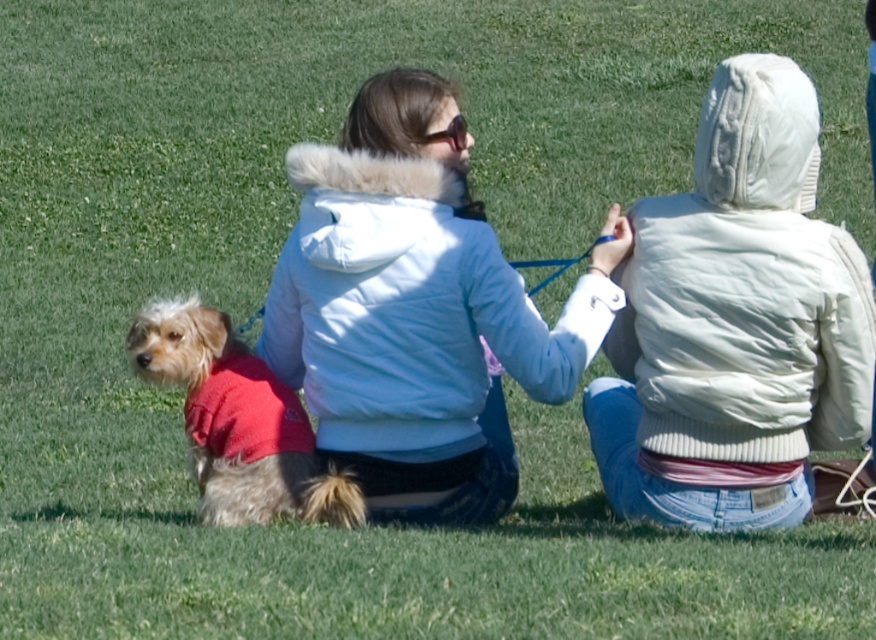
Is light blue puffy jacket at center to the left of fuzzy red sweater at lower left from the viewer's perspective?

Incorrect, light blue puffy jacket at center is not on the left side of fuzzy red sweater at lower left.

Which is behind, point (398, 518) or point (298, 404)?

Point (298, 404)

Does point (421, 420) lie in front of point (246, 358)?

Yes.

Locate an element on the screen. The width and height of the screenshot is (876, 640). light blue puffy jacket at center is located at coordinates (415, 310).

Measure the distance from white fuzzy jacket at upper right to light blue puffy jacket at center.

white fuzzy jacket at upper right and light blue puffy jacket at center are 24.01 inches apart from each other.

Is white fuzzy jacket at upper right to the left of light blue puffy jacket at center from the viewer's perspective?

No, white fuzzy jacket at upper right is not to the left of light blue puffy jacket at center.

Find the location of a particular element. white fuzzy jacket at upper right is located at coordinates point(735,323).

Does light blue puffy jacket at center appear over clear plastic goggles at center?

Incorrect, light blue puffy jacket at center is not positioned above clear plastic goggles at center.

The width and height of the screenshot is (876, 640). What do you see at coordinates (415, 310) in the screenshot?
I see `light blue puffy jacket at center` at bounding box center [415, 310].

The image size is (876, 640). I want to click on light blue puffy jacket at center, so [415, 310].